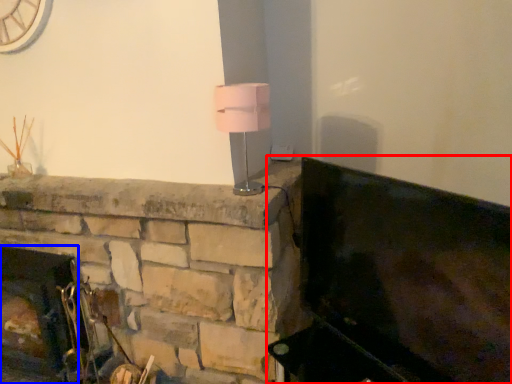
Question: Among these objects, which one is farthest to the camera, furniture (highlighted by a red box) or fireplace (highlighted by a blue box)?

Choices:
 (A) furniture
 (B) fireplace

Answer: (B)